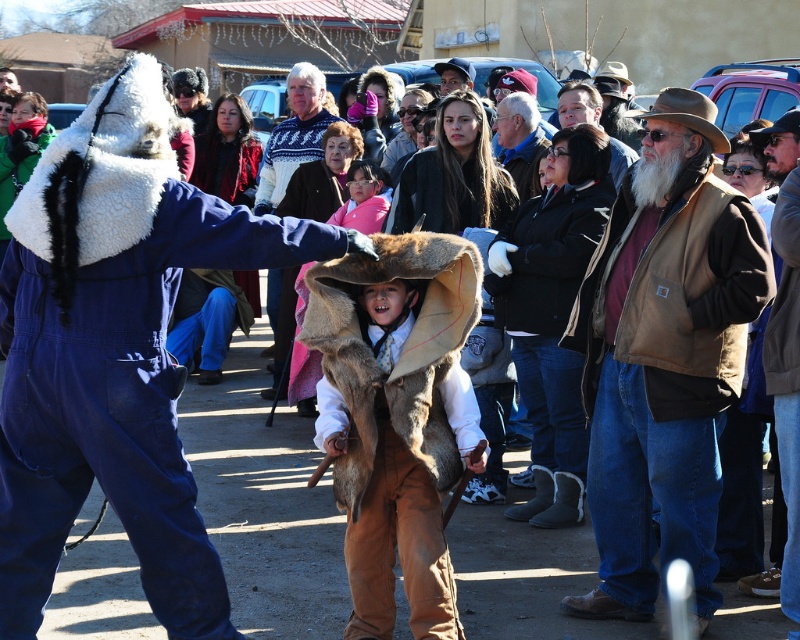
Question: Considering the relative positions of brown suede vest at center and gray woolen hat at center in the image provided, where is brown suede vest at center located with respect to gray woolen hat at center?

Choices:
 (A) below
 (B) above

Answer: (A)

Question: Observing the image, what is the correct spatial positioning of fur coat at center in reference to gray woolen hat at center?

Choices:
 (A) below
 (B) above

Answer: (A)

Question: Which object is the farthest from the knitted sweater at center?

Choices:
 (A) pink fleece jacket at center
 (B) fur coat at center
 (C) brown leather jacket at center

Answer: (B)

Question: Which of the following is the closest to the observer?

Choices:
 (A) (266, 164)
 (B) (518, 157)
 (C) (389, 259)

Answer: (C)

Question: Can you confirm if brown suede vest at center is positioned to the right of pink fleece jacket at center?

Choices:
 (A) yes
 (B) no

Answer: (A)

Question: Which object is positioned farthest from the knitted sweater at center?

Choices:
 (A) brown suede vest at center
 (B) fur coat at center

Answer: (B)